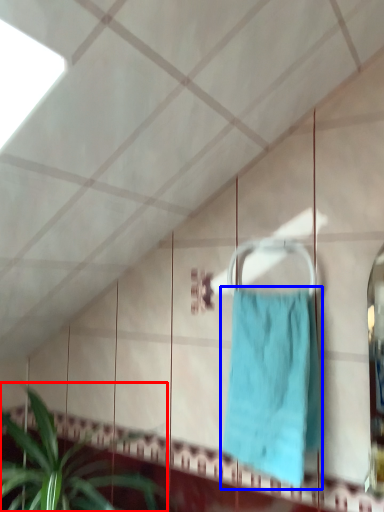
Question: Which point is closer to the camera, houseplant (highlighted by a red box) or towel (highlighted by a blue box)?

Choices:
 (A) houseplant
 (B) towel

Answer: (A)